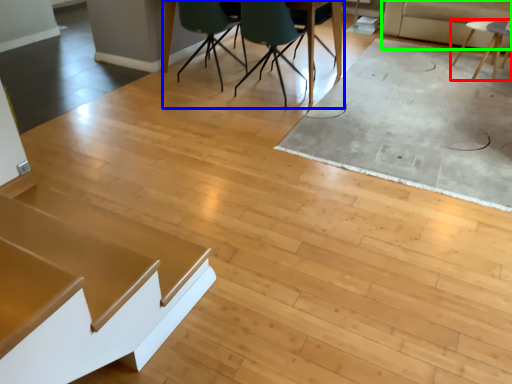
Question: Considering the real-world distances, which object is farthest from table (highlighted by a red box)? table (highlighted by a blue box) or couch (highlighted by a green box)?

Choices:
 (A) table
 (B) couch

Answer: (A)